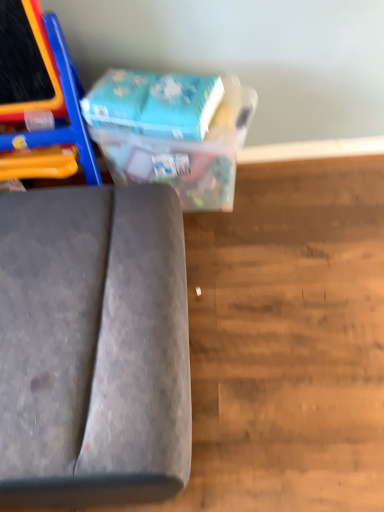
Question: Does velvet grey sofa at lower left have a lesser height compared to blue cardboard box at upper center?

Choices:
 (A) no
 (B) yes

Answer: (A)

Question: Is velvet grey sofa at lower left not within blue cardboard box at upper center?

Choices:
 (A) yes
 (B) no

Answer: (A)

Question: Can you confirm if velvet grey sofa at lower left is taller than blue cardboard box at upper center?

Choices:
 (A) yes
 (B) no

Answer: (A)

Question: Is velvet grey sofa at lower left aimed at blue cardboard box at upper center?

Choices:
 (A) no
 (B) yes

Answer: (A)

Question: Is velvet grey sofa at lower left in front of blue cardboard box at upper center?

Choices:
 (A) yes
 (B) no

Answer: (A)

Question: Can you confirm if velvet grey sofa at lower left is positioned to the right of blue cardboard box at upper center?

Choices:
 (A) no
 (B) yes

Answer: (A)

Question: Is the position of blue cardboard box at upper center more distant than that of blue cardboard box at upper center?

Choices:
 (A) no
 (B) yes

Answer: (B)

Question: From a real-world perspective, is blue cardboard box at upper center under blue cardboard box at upper center?

Choices:
 (A) yes
 (B) no

Answer: (A)

Question: From a real-world perspective, is blue cardboard box at upper center located higher than blue cardboard box at upper center?

Choices:
 (A) yes
 (B) no

Answer: (B)

Question: Considering the relative positions of blue cardboard box at upper center and blue cardboard box at upper center in the image provided, is blue cardboard box at upper center to the left of blue cardboard box at upper center from the viewer's perspective?

Choices:
 (A) yes
 (B) no

Answer: (B)

Question: Is blue cardboard box at upper center not near blue cardboard box at upper center?

Choices:
 (A) no
 (B) yes

Answer: (A)

Question: Is blue cardboard box at upper center surrounded by blue cardboard box at upper center?

Choices:
 (A) yes
 (B) no

Answer: (B)

Question: Can you confirm if blue cardboard box at upper center is smaller than blue cardboard box at upper center?

Choices:
 (A) no
 (B) yes

Answer: (B)